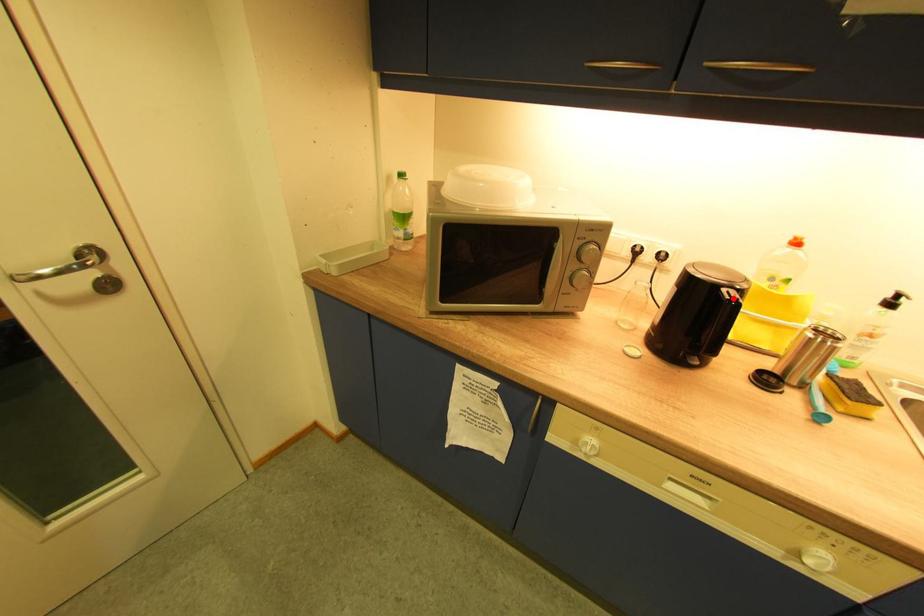
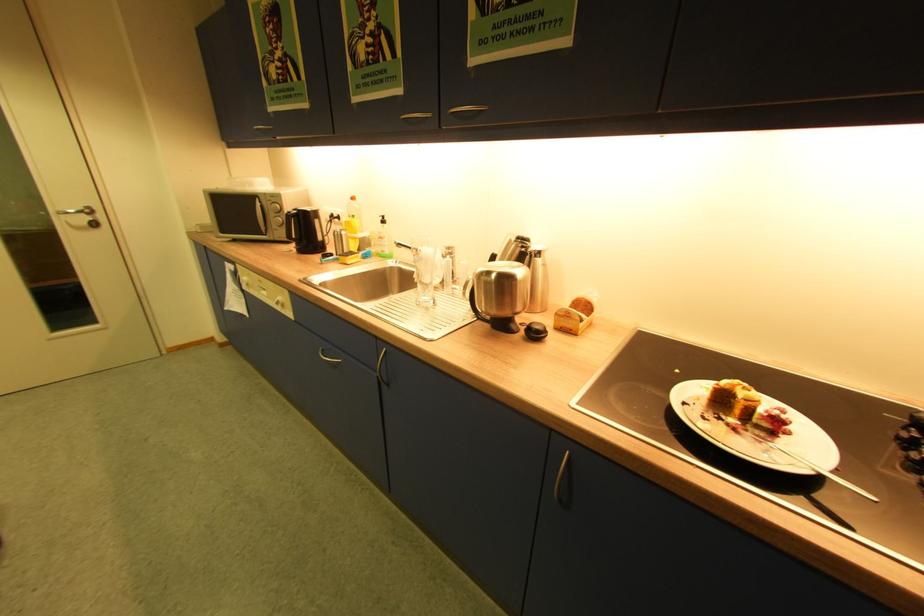
Question: I am providing you with two images of the same scene from different viewpoints. A red point is marked on the first image. At the location where the point appears in image 1, is it still visible in image 2?

Choices:
 (A) Yes
 (B) No

Answer: (B)